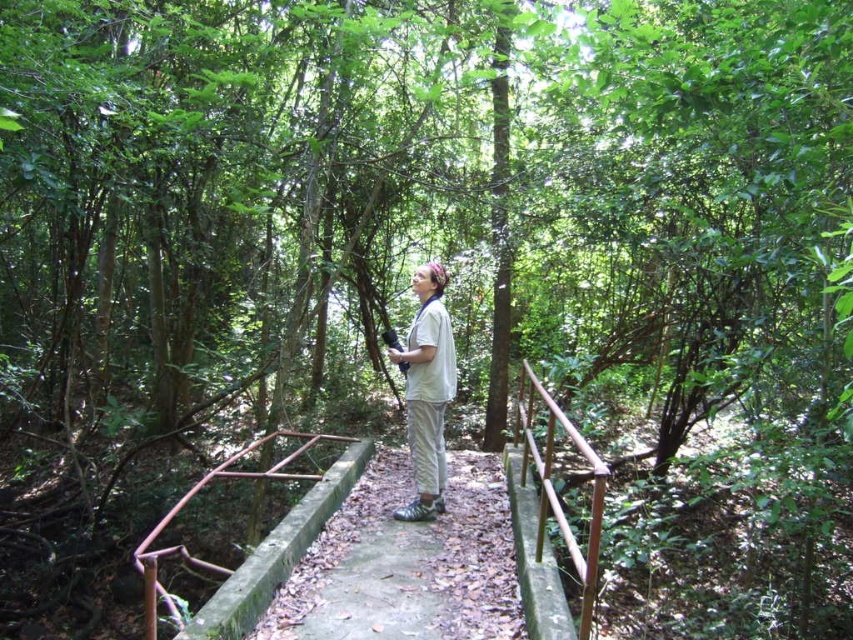
Question: Does concrete at center lie in front of white cotton shirt at center?

Choices:
 (A) yes
 (B) no

Answer: (A)

Question: Estimate the real-world distances between objects in this image. Which object is farther from the white cotton shirt at center?

Choices:
 (A) rusty metal rail at center
 (B) brown wooden rail at center
 (C) concrete at center

Answer: (A)

Question: Does rusty metal rail at center have a lesser width compared to white cotton shirt at center?

Choices:
 (A) yes
 (B) no

Answer: (B)

Question: Which object is the closest to the concrete at center?

Choices:
 (A) rusty metal rail at center
 (B) white cotton shirt at center
 (C) brown wooden rail at center

Answer: (B)

Question: From the image, what is the correct spatial relationship of concrete at center in relation to brown wooden rail at center?

Choices:
 (A) right
 (B) left

Answer: (B)

Question: Which point is farther to the camera?

Choices:
 (A) concrete at center
 (B) white cotton shirt at center

Answer: (B)